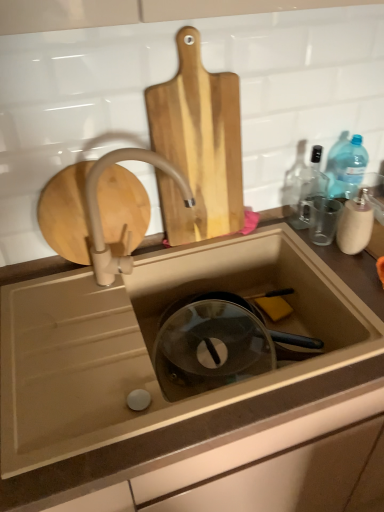
Question: From the image's perspective, is transparent glass bottle at upper right beneath translucent plastic sink at center?

Choices:
 (A) yes
 (B) no

Answer: (B)

Question: Are transparent glass bottle at upper right and translucent plastic sink at center located far from each other?

Choices:
 (A) no
 (B) yes

Answer: (A)

Question: Does transparent glass bottle at upper right have a greater height compared to translucent plastic sink at center?

Choices:
 (A) no
 (B) yes

Answer: (A)

Question: Is transparent glass bottle at upper right aimed at translucent plastic sink at center?

Choices:
 (A) no
 (B) yes

Answer: (A)

Question: Is transparent glass bottle at upper right completely or partially outside of translucent plastic sink at center?

Choices:
 (A) no
 (B) yes

Answer: (B)

Question: Looking at the image, does transparent glass bottle at upper right seem bigger or smaller compared to translucent plastic sink at center?

Choices:
 (A) small
 (B) big

Answer: (A)

Question: From their relative heights in the image, would you say transparent glass bottle at upper right is taller or shorter than translucent plastic sink at center?

Choices:
 (A) tall
 (B) short

Answer: (B)

Question: Does point (314, 153) appear closer or farther from the camera than point (130, 411)?

Choices:
 (A) farther
 (B) closer

Answer: (A)

Question: Which is correct: transparent glass bottle at upper right is inside translucent plastic sink at center, or outside of it?

Choices:
 (A) outside
 (B) inside

Answer: (A)

Question: Is white matte faucet at upper center spatially inside natural wood cutting board at upper center, or outside of it?

Choices:
 (A) inside
 (B) outside

Answer: (B)

Question: Considering the positions of point (175, 177) and point (211, 229), is point (175, 177) closer or farther from the camera than point (211, 229)?

Choices:
 (A) closer
 (B) farther

Answer: (A)

Question: In the image, is white matte faucet at upper center positioned in front of or behind natural wood cutting board at upper center?

Choices:
 (A) behind
 (B) front

Answer: (B)

Question: In terms of height, does white matte faucet at upper center look taller or shorter compared to natural wood cutting board at upper center?

Choices:
 (A) tall
 (B) short

Answer: (B)

Question: Would you say natural wood cutting board at upper center is inside or outside yellow sponge at sink bottom?

Choices:
 (A) inside
 (B) outside

Answer: (B)

Question: Considering the positions of natural wood cutting board at upper center and yellow sponge at sink bottom in the image, is natural wood cutting board at upper center taller or shorter than yellow sponge at sink bottom?

Choices:
 (A) short
 (B) tall

Answer: (B)